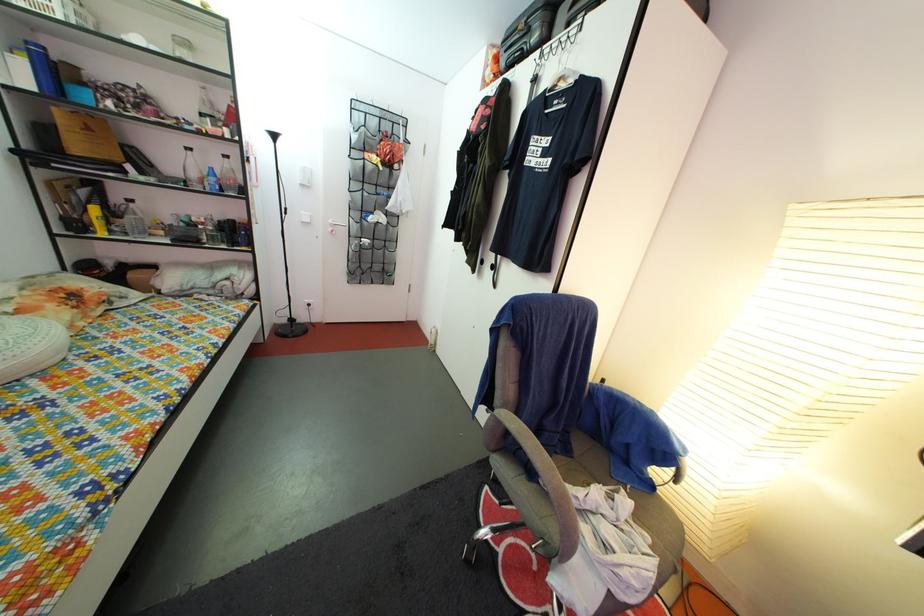
Find the location of a particular element. grey chair armrest is located at coordinates (545, 480).